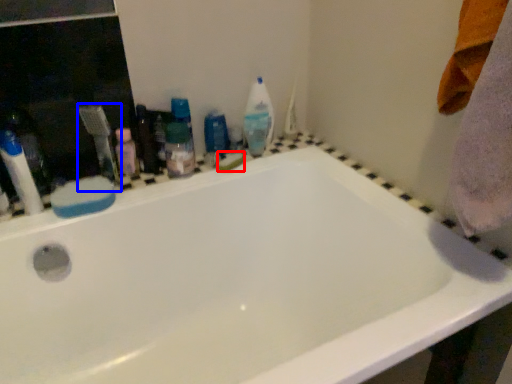
Question: Which object appears closest to the camera in this image, soap (highlighted by a red box) or toothbrush (highlighted by a blue box)?

Choices:
 (A) soap
 (B) toothbrush

Answer: (B)